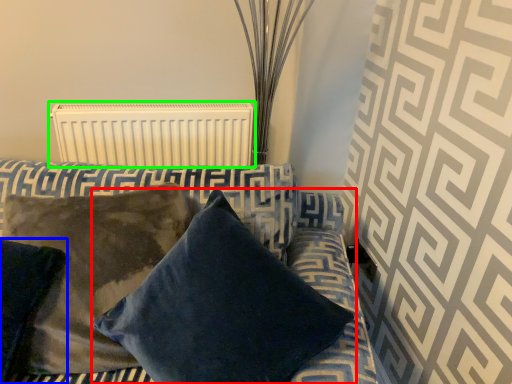
Question: Which object is the closest to the pillow (highlighted by a red box)? Choose among these: pillow (highlighted by a blue box) or radiator (highlighted by a green box).

Choices:
 (A) pillow
 (B) radiator

Answer: (A)